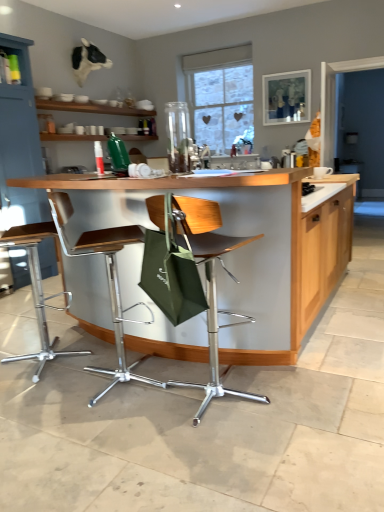
The width and height of the screenshot is (384, 512). Identify the location of vacant space that is to the left of brown leather chair at center, which is counted as the 1th chair, starting from the right. (124, 423).